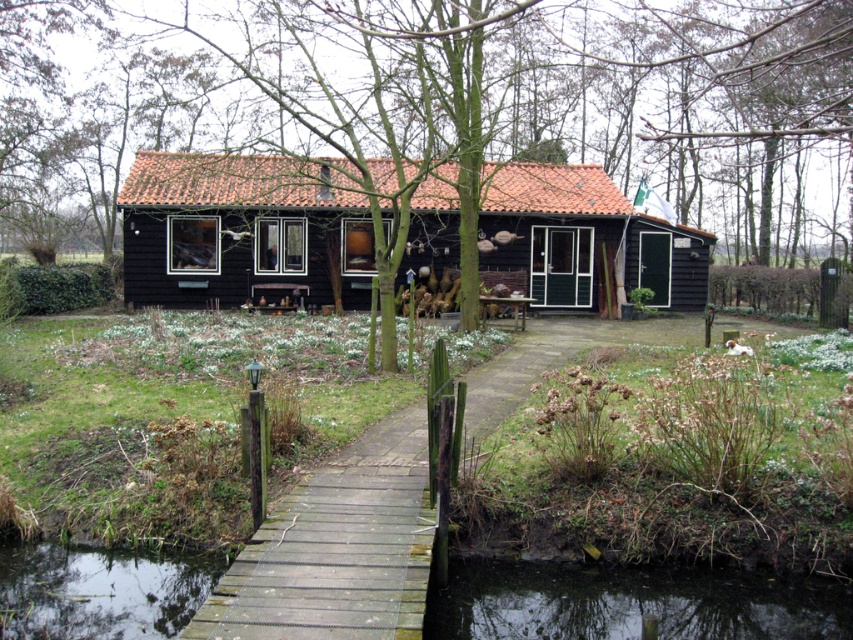
This screenshot has width=853, height=640. Describe the element at coordinates (241, 230) in the screenshot. I see `black wood cottage at center` at that location.

Where is `black wood cottage at center`? The width and height of the screenshot is (853, 640). black wood cottage at center is located at coordinates (241, 230).

Which is above, black water at lower left or transparent water at bridge bottom?

transparent water at bridge bottom

Which is behind, point (746, 636) or point (135, 612)?

The point (135, 612) is more distant.

Find the location of a particular element. black water at lower left is located at coordinates (631, 604).

Is point (759, 256) positioned before point (161, 618)?

That is False.

Between point (230, 44) and point (132, 564), which one is positioned behind?

The point (230, 44) is more distant.

Measure the distance between green leafy tree at center and camera.

4.57 meters

Locate an element on the screen. The image size is (853, 640). green leafy tree at center is located at coordinates (440, 141).